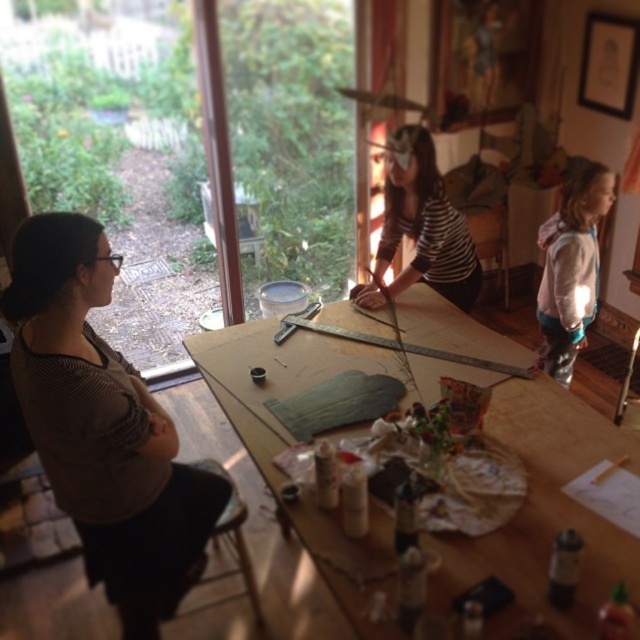
Between wooden table at center and white fleece jacket at right, which one appears on the right side from the viewer's perspective?

white fleece jacket at right

Can you confirm if wooden table at center is bigger than white fleece jacket at right?

Correct, wooden table at center is larger in size than white fleece jacket at right.

Who is more distant from viewer, (410, 317) or (582, 257)?

Point (410, 317)

This screenshot has height=640, width=640. I want to click on wooden table at center, so click(538, 502).

Between point (426, 193) and point (236, 516), which one is positioned in front?

Positioned in front is point (236, 516).

Measure the distance between point (428, 221) and camera.

Point (428, 221) and camera are 8.91 feet apart from each other.

Is point (413, 262) positioned before point (234, 522)?

No.

In order to click on striped fabric at center in this screenshot , I will do `click(420, 227)`.

What do you see at coordinates (102, 426) in the screenshot? The height and width of the screenshot is (640, 640). I see `brown striped shirt at left` at bounding box center [102, 426].

Is brown striped shirt at left behind white fleece jacket at right?

No, brown striped shirt at left is closer to the viewer.

The width and height of the screenshot is (640, 640). In order to click on brown striped shirt at left in this screenshot , I will do `click(102, 426)`.